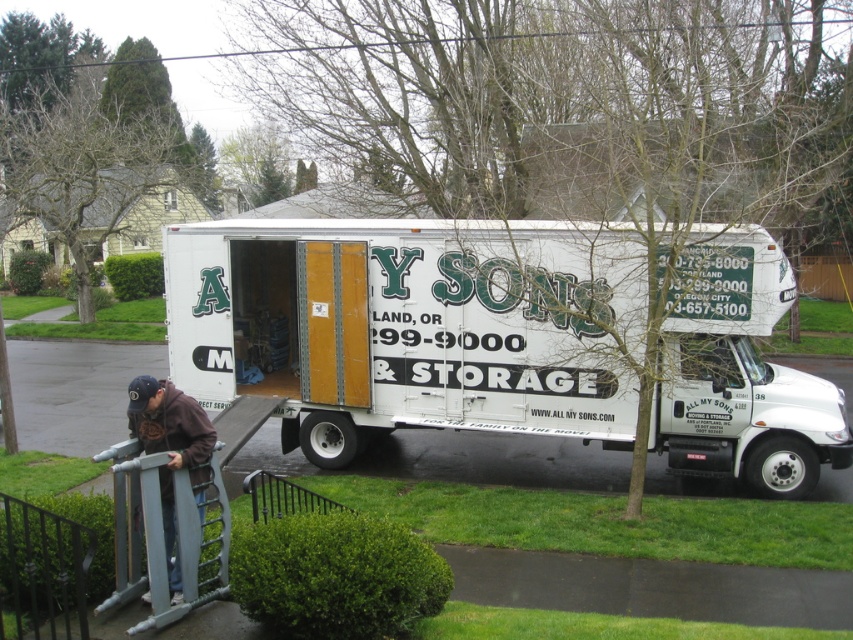
Describe the element at coordinates (407, 324) in the screenshot. The image size is (853, 640). I see `white matte truck at center` at that location.

Is point (242, 282) positioned behind point (165, 508)?

Yes, it is.

I want to click on white matte truck at center, so click(407, 324).

Between brown hoodie at lower left and black metal/rail at lower center, which one appears on the right side from the viewer's perspective?

Positioned to the right is black metal/rail at lower center.

Can you confirm if brown hoodie at lower left is positioned to the left of black metal/rail at lower center?

Yes, brown hoodie at lower left is to the left of black metal/rail at lower center.

Image resolution: width=853 pixels, height=640 pixels. Find the location of `brown hoodie at lower left`. brown hoodie at lower left is located at coordinates (171, 451).

Who is more forward, (x=785, y=301) or (x=270, y=508)?

Positioned in front is point (x=785, y=301).

In the scene shown: Is white matte truck at center positioned before black metal/rail at lower center?

No.

Where is `white matte truck at center`? The image size is (853, 640). white matte truck at center is located at coordinates (407, 324).

The image size is (853, 640). Find the location of `white matte truck at center`. white matte truck at center is located at coordinates (407, 324).